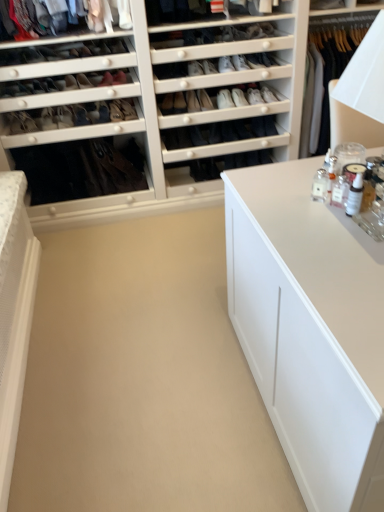
Question: From their relative heights in the image, would you say white matte cabinet at center is taller or shorter than matte black shoe at center, which appears as the fourth shoe when viewed from the left?

Choices:
 (A) short
 (B) tall

Answer: (A)

Question: From a real-world perspective, relative to matte black shoe at center, positioned as the 6th shoe in right-to-left order, is white matte cabinet at center vertically above or below?

Choices:
 (A) below
 (B) above

Answer: (A)

Question: Which object is the farthest from the matte black shoe at center, which is the 6th shoe from left to right?

Choices:
 (A) clear glass bottles at upper right
 (B) matte black shoe at center, the 7th shoe from the left
 (C) white leather shoe at upper center, which is counted as the 1th shoe, starting from the right
 (D) white leather shoe at upper center, which is the 2th shoe in right-to-left order
 (E) matte black shoe at center, which is counted as the second shoe, starting from the left

Answer: (E)

Question: Estimate the real-world distances between objects in this image. Which object is farther from the matte black shoe at center, which appears as the 7th shoe when viewed from the right?

Choices:
 (A) white leather shoe at upper center, which is counted as the 1th shoe, starting from the right
 (B) white leather shoe at upper center, the eighth shoe in the left-to-right sequence
 (C) matte black shoe at center, which is the 6th shoe from left to right
 (D) clear glass bottles at upper right
 (E) matte black shoe at center, which appears as the fourth shoe when viewed from the left

Answer: (D)